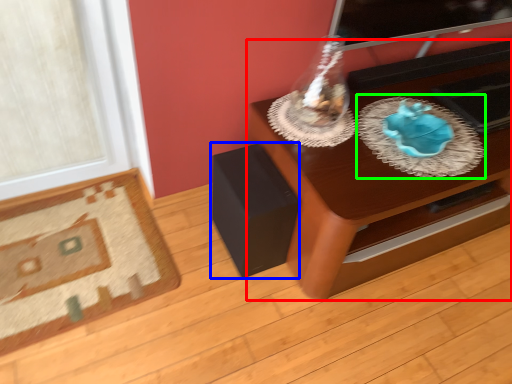
Question: Which is nearer to the table (highlighted by a red box)? speaker (highlighted by a blue box) or glass plate (highlighted by a green box).

Choices:
 (A) speaker
 (B) glass plate

Answer: (B)